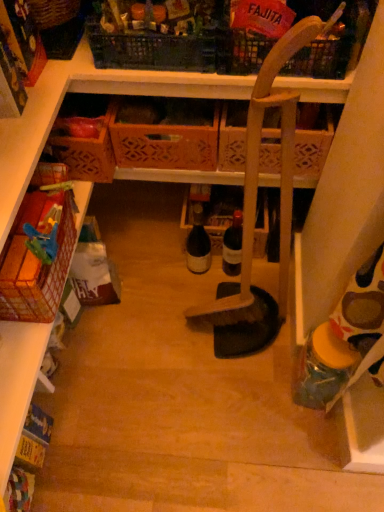
The image size is (384, 512). Identify the location of free space to the left of wooden broom at center. (171, 334).